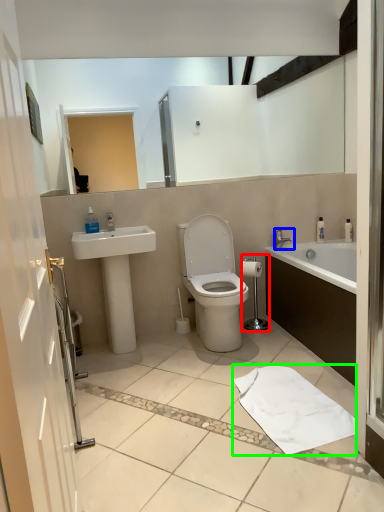
Question: Estimate the real-world distances between objects in this image. Which object is farther from shower (highlighted by a red box), tap (highlighted by a blue box) or bath towel (highlighted by a green box)?

Choices:
 (A) tap
 (B) bath towel

Answer: (B)